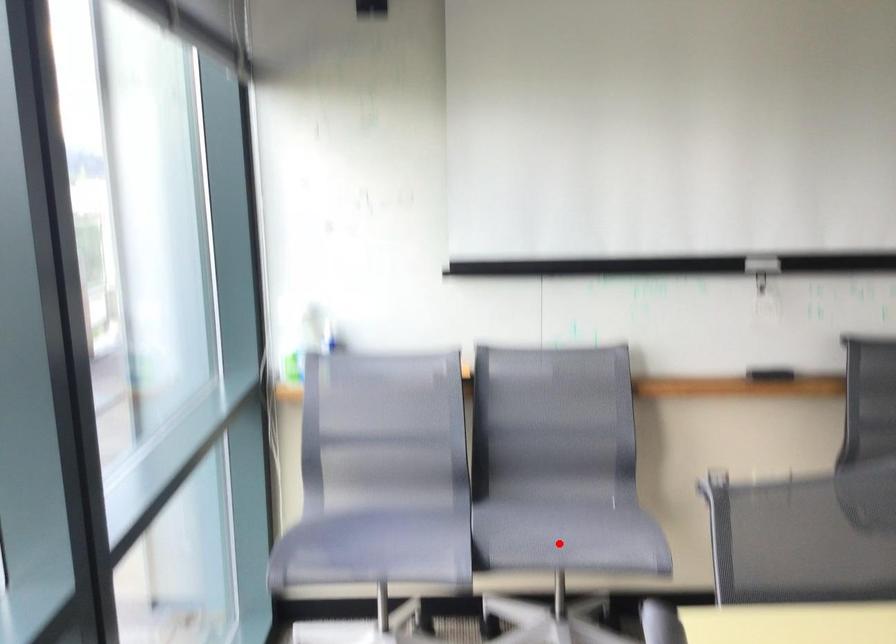
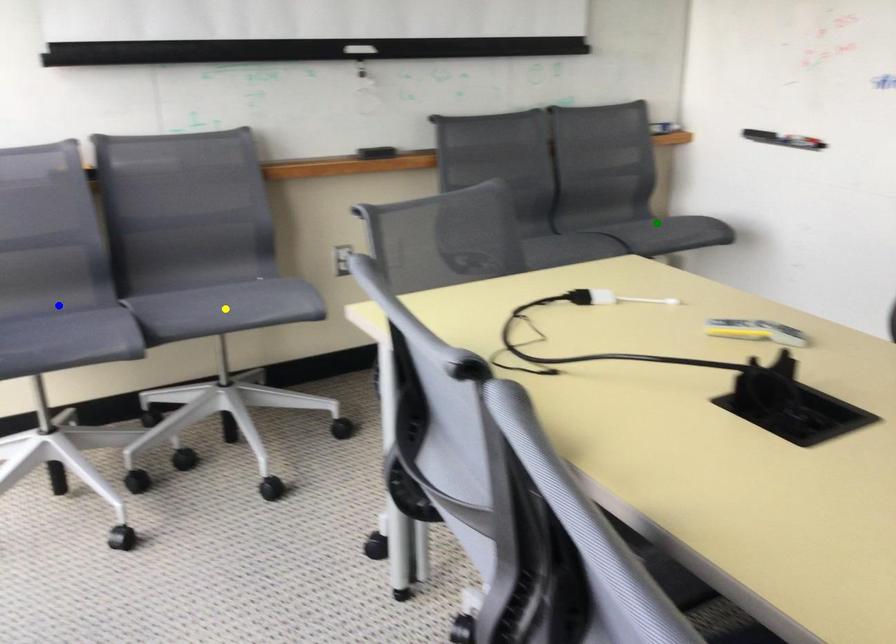
Question: I am providing you with two images of the same scene from different viewpoints. A red point is marked on the first image. You are given multiple points on the second image. Which mark in image 2 goes with the point in image 1?

Choices:
 (A) blue point
 (B) yellow point
 (C) green point

Answer: (B)